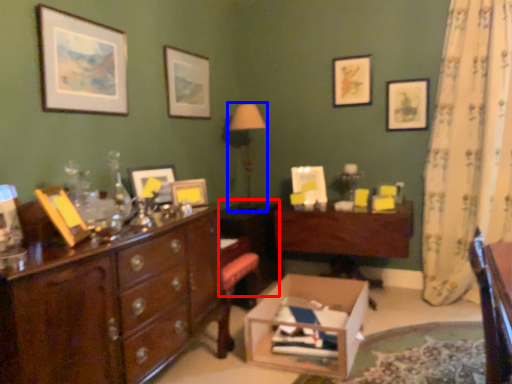
Question: Which object is further to the camera taking this photo, cabinetry (highlighted by a red box) or table lamp (highlighted by a blue box)?

Choices:
 (A) cabinetry
 (B) table lamp

Answer: (B)